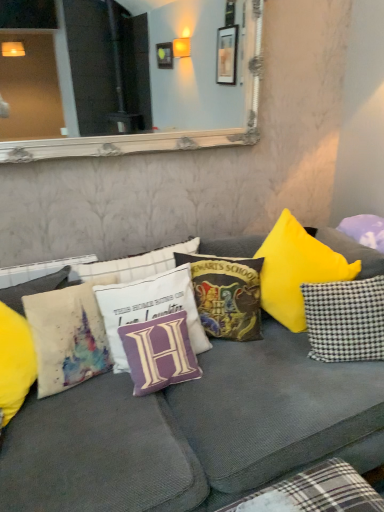
Question: From the image's perspective, is checkered fabric pillow at right, which appears as the 5th pillow when viewed from the left, positioned above or below purple fabric pillow at right, the 1th pillow when ordered from right to left?

Choices:
 (A) below
 (B) above

Answer: (A)

Question: From a real-world perspective, is checkered fabric pillow at right, which appears as the 5th pillow when viewed from the left, physically located above or below purple fabric pillow at right, the 1th pillow when ordered from right to left?

Choices:
 (A) below
 (B) above

Answer: (A)

Question: Considering the real-world distances, which object is farthest from the white textured mirror at upper center?

Choices:
 (A) purple fabric pillow at right, the 1th pillow when ordered from right to left
 (B) textured gray couch at center
 (C) velvet hogwarts school of witchcraft and wizardry pillow at center, the 4th pillow viewed from the left
 (D) checkered fabric pillow at right, marked as the second pillow in a right-to-left arrangement
 (E) watercolor fabric pillow at left, the first pillow from the left

Answer: (B)

Question: Which is farther from the watercolor fabric pillow at left, which is counted as the 6th pillow, starting from the right?

Choices:
 (A) white textured mirror at upper center
 (B) purple fabric pillow at center, which appears as the 3th pillow when viewed from the left
 (C) textured gray couch at center
 (D) checkered fabric pillow at right, marked as the second pillow in a right-to-left arrangement
 (E) white fabric pillow with purple letter h at center, the 5th pillow when ordered from right to left

Answer: (D)